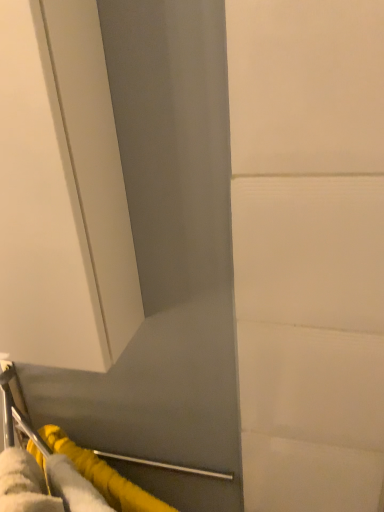
At what (x,y) coordinates should I click in order to perform the action: click on matte white cabinet at center. Please return your answer as a coordinate pair (x, y). Looking at the image, I should click on (61, 193).

Describe the element at coordinates (61, 193) in the screenshot. I see `matte white cabinet at center` at that location.

Measure the distance between matte white cabinet at center and camera.

A distance of 16.18 inches exists between matte white cabinet at center and camera.

Find the location of a particular element. Image resolution: width=384 pixels, height=512 pixels. matte white cabinet at center is located at coordinates pyautogui.click(x=61, y=193).